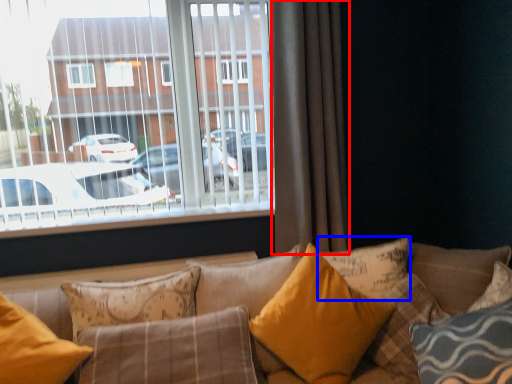
Question: Which of the following is the closest to the observer, curtain (highlighted by a red box) or pillow (highlighted by a blue box)?

Choices:
 (A) curtain
 (B) pillow

Answer: (B)